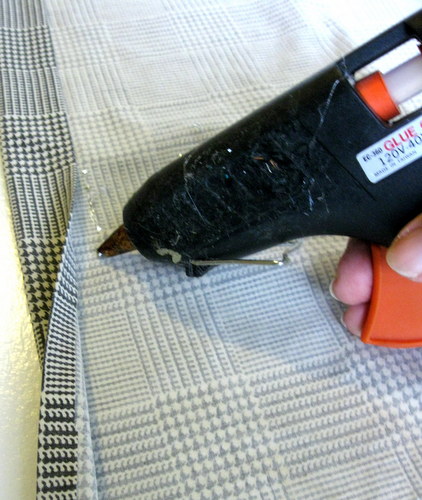
Find the location of a particular element. Image resolution: width=422 pixels, height=500 pixels. fabric is located at coordinates (195, 356).